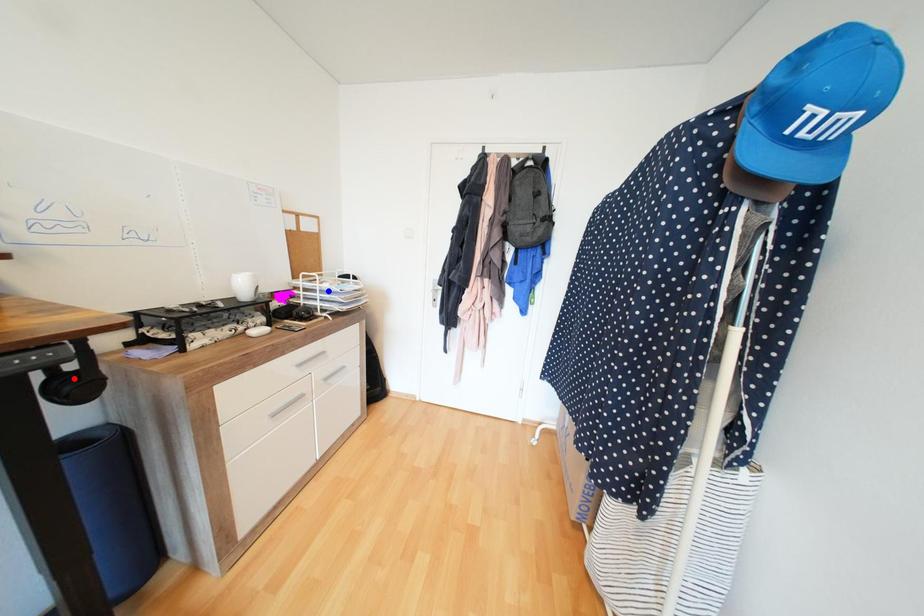
Question: Which of the two points in the image is closer to the camera?

Choices:
 (A) Blue point is closer.
 (B) Red point is closer.

Answer: (B)